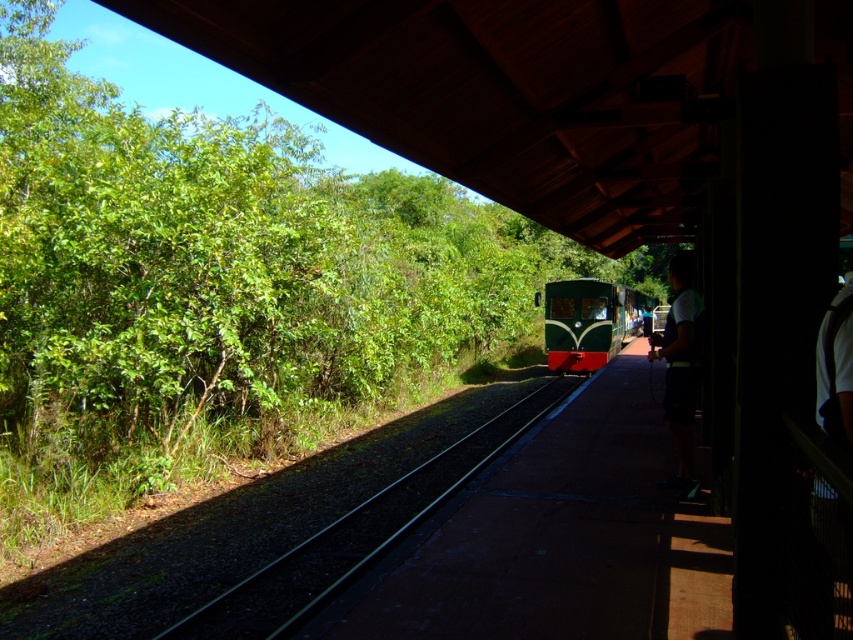
Question: Which object is farther from the camera taking this photo?

Choices:
 (A) green gravel track at center
 (B) green matte train at center

Answer: (B)

Question: Does green gravel track at center appear on the left side of dark blue shorts at right?

Choices:
 (A) no
 (B) yes

Answer: (B)

Question: Which point appears farthest from the camera in this image?

Choices:
 (A) (236, 608)
 (B) (575, 304)

Answer: (B)

Question: Which of the following is the closest to the observer?

Choices:
 (A) (694, 396)
 (B) (262, 605)

Answer: (B)

Question: Can you confirm if green gravel track at center is positioned to the right of dark blue shorts at right?

Choices:
 (A) no
 (B) yes

Answer: (A)

Question: Does green matte train at center appear under dark blue shorts at right?

Choices:
 (A) no
 (B) yes

Answer: (A)